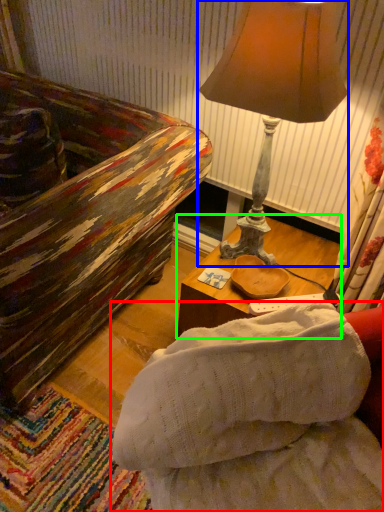
Question: Which object is positioned farthest from studio couch (highlighted by a red box)? Select from lamp (highlighted by a blue box) and table (highlighted by a green box).

Choices:
 (A) lamp
 (B) table

Answer: (A)